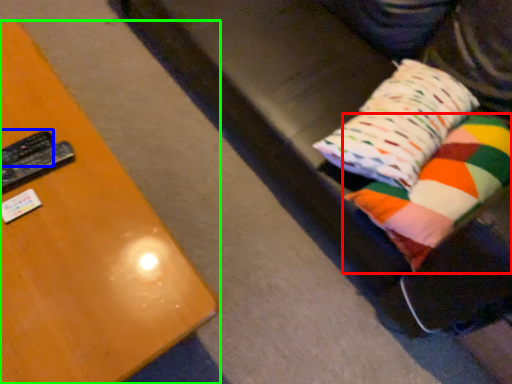
Question: Which is nearer to the pillow (highlighted by a red box)? remote (highlighted by a blue box) or furniture (highlighted by a green box).

Choices:
 (A) remote
 (B) furniture

Answer: (B)